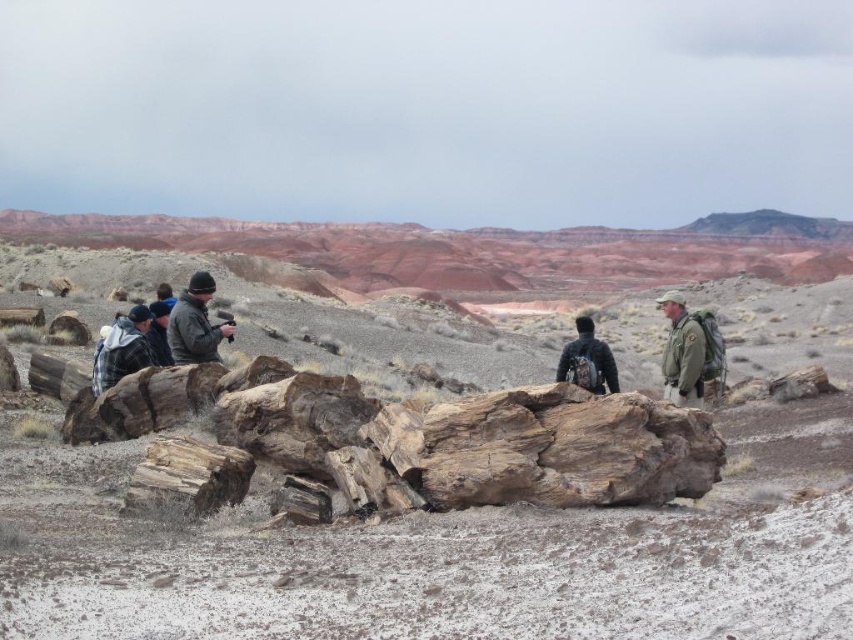
Which is behind, point (688, 317) or point (578, 355)?

Point (688, 317)

Can you confirm if green uniform at center is smaller than black matte jacket at center?

Incorrect, green uniform at center is not smaller in size than black matte jacket at center.

Find the location of a particular element. This screenshot has height=640, width=853. green uniform at center is located at coordinates (682, 353).

Is dark gray wool jacket at center smaller than dark gray wool hat at left?

Correct, dark gray wool jacket at center occupies less space than dark gray wool hat at left.

Between point (222, 330) and point (164, 307), which one is positioned behind?

Point (164, 307)

You are a GUI agent. You are given a task and a screenshot of the screen. Output one action in this format:
    pyautogui.click(x=<x>, y=<y>)
    Task: Click on the dark gray wool jacket at center
    This screenshot has width=853, height=640.
    Given the screenshot: What is the action you would take?
    pyautogui.click(x=195, y=323)

Consider the image. Can you confirm if plaid fabric jacket at left is bigger than black matte jacket at center?

Yes, plaid fabric jacket at left is bigger than black matte jacket at center.

Which is more to the left, plaid fabric jacket at left or black matte jacket at center?

From the viewer's perspective, plaid fabric jacket at left appears more on the left side.

At what (x,y) coordinates should I click in order to perform the action: click on plaid fabric jacket at left. Please return your answer as a coordinate pair (x, y). Looking at the image, I should click on (122, 348).